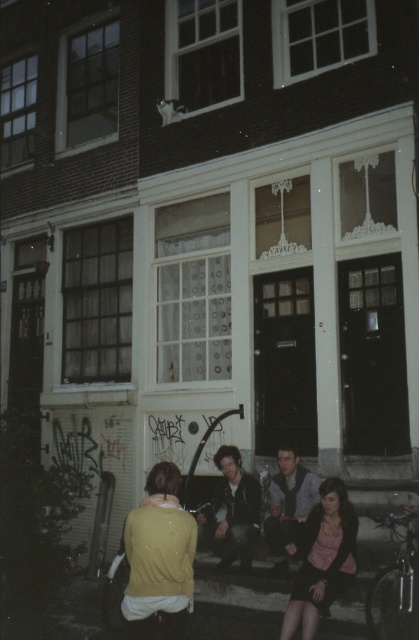
Question: Can you confirm if dark gray leather jacket at center is smaller than gray textured vest at center?

Choices:
 (A) no
 (B) yes

Answer: (A)

Question: Can you confirm if dark gray leather jacket at center is positioned to the right of gray textured vest at center?

Choices:
 (A) no
 (B) yes

Answer: (A)

Question: Does dark gray leather jacket at center appear on the right side of gray textured vest at center?

Choices:
 (A) no
 (B) yes

Answer: (A)

Question: Which object appears closest to the camera in this image?

Choices:
 (A) gray textured vest at center
 (B) dark gray leather jacket at center

Answer: (A)

Question: Which point appears closest to the camera in this image?

Choices:
 (A) (217, 492)
 (B) (299, 516)

Answer: (B)